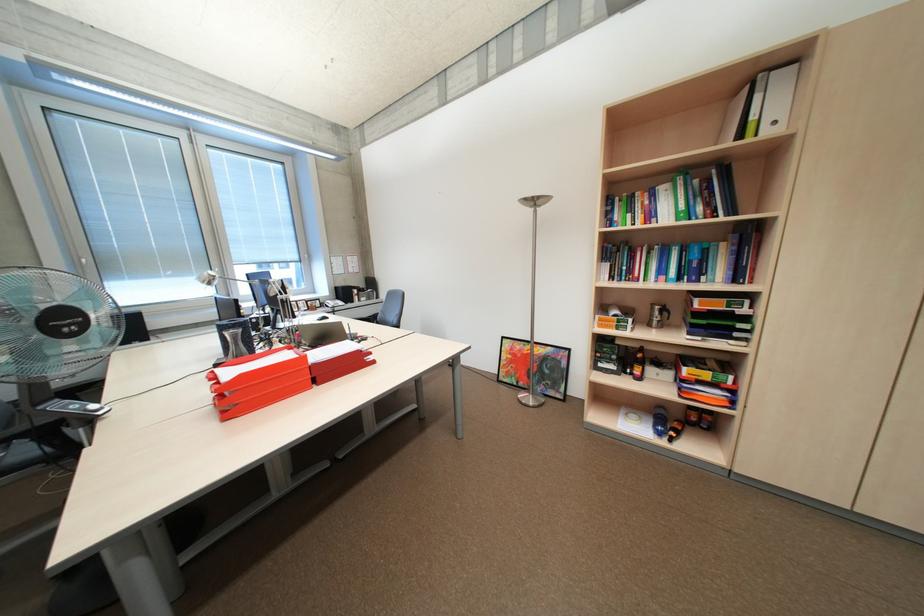
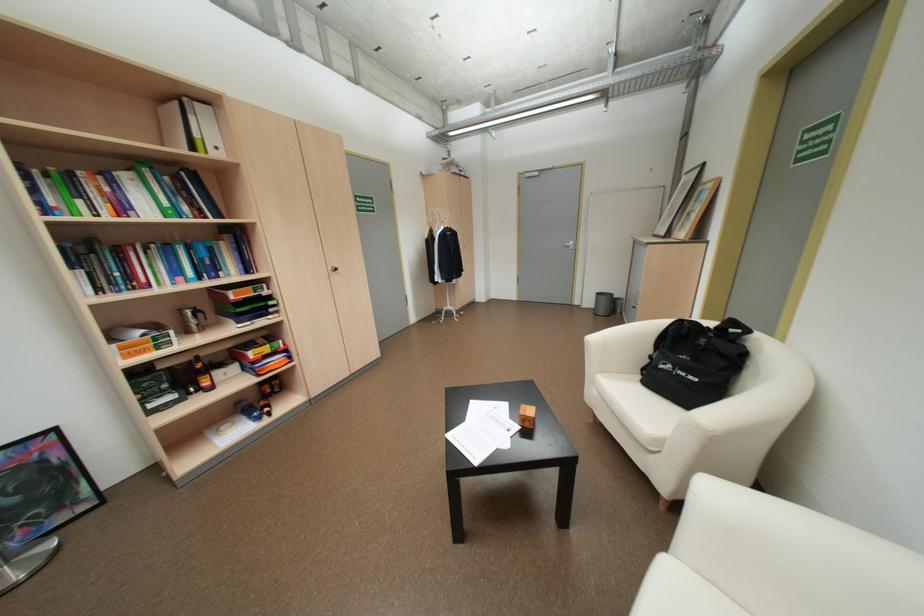
First-person continuous shooting, in which direction is the camera rotating?

The rotation direction of the camera is right-down.